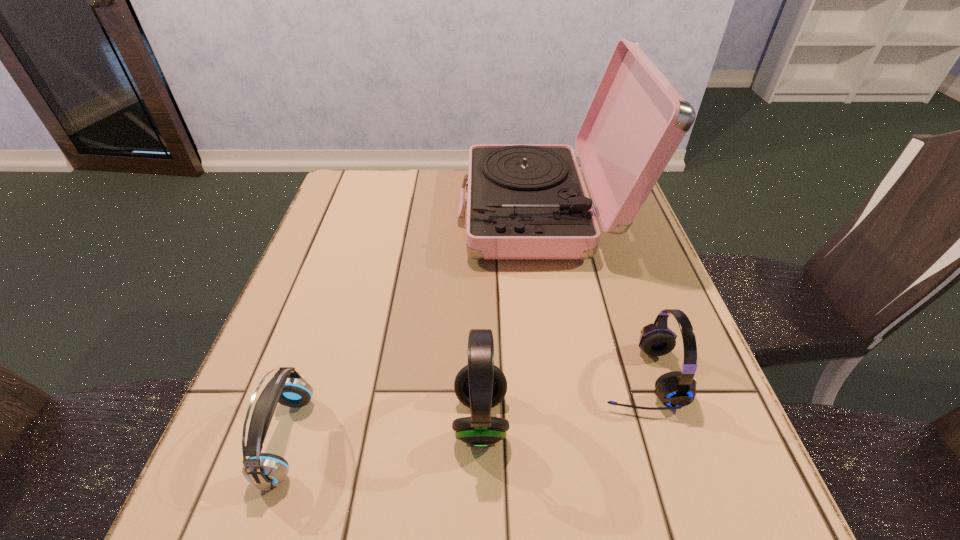
Find the location of a particular element. The image size is (960, 540). vacant space located 0.170m with the lid open on the farthest object is located at coordinates (396, 212).

Locate an element on the screen. This screenshot has width=960, height=540. vacant space located 0.260m on the ear cups of the tallest headset is located at coordinates (300, 418).

Image resolution: width=960 pixels, height=540 pixels. I want to click on free location located 0.290m on the ear cups of the tallest headset, so click(x=283, y=418).

Locate an element on the screen. vacant space located on the ear cups of the tallest headset is located at coordinates (396, 418).

The image size is (960, 540). Find the location of `free region located on the ear cushions of the third tallest object`. free region located on the ear cushions of the third tallest object is located at coordinates pyautogui.click(x=483, y=376).

Locate an element on the screen. This screenshot has height=540, width=960. blank space located 0.390m on the ear cushions of the third tallest object is located at coordinates (385, 376).

What are the coordinates of `vacant region located 0.350m on the ear cushions of the third tallest object` in the screenshot? It's located at (407, 376).

The image size is (960, 540). What are the coordinates of `vacant space located on the ear cups of the leftmost object` in the screenshot? It's located at (519, 439).

Where is `object that is at the far edge`? The height and width of the screenshot is (540, 960). object that is at the far edge is located at coordinates (525, 201).

This screenshot has height=540, width=960. In order to click on object at the near edge in this screenshot , I will do `click(265, 471)`.